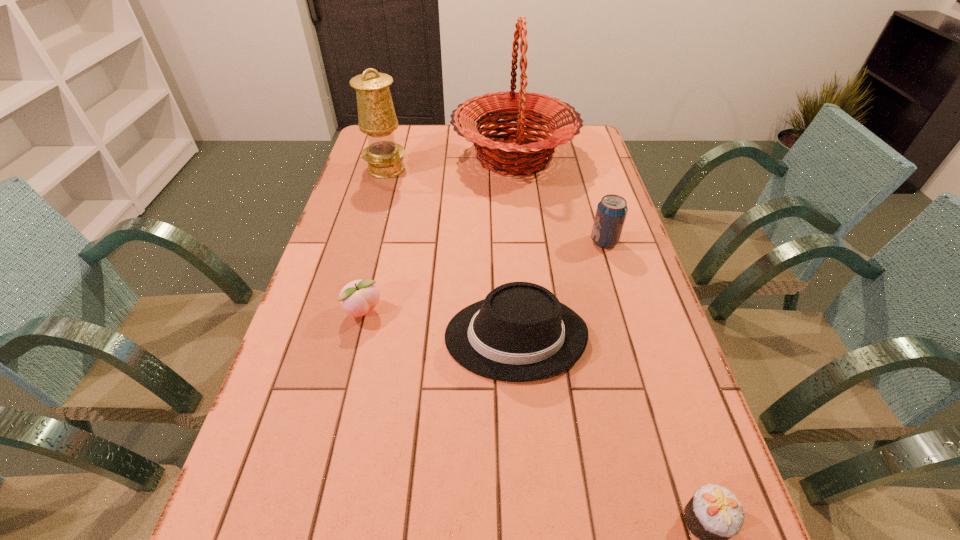
At what (x,y) coordinates should I click in order to perform the action: click on vacant area located on the front-facing side of the third shortest object. Please return your answer as a coordinate pair (x, y). This screenshot has height=540, width=960. Looking at the image, I should click on (376, 336).

Where is `vacant space situated on the front of the second shortest object`? Image resolution: width=960 pixels, height=540 pixels. vacant space situated on the front of the second shortest object is located at coordinates click(x=335, y=431).

This screenshot has width=960, height=540. In order to click on object present at the far edge in this screenshot , I will do `click(509, 156)`.

Identify the location of oil lamp that is at the left edge. (377, 118).

Where is `peach situated at the left edge`? The image size is (960, 540). peach situated at the left edge is located at coordinates (357, 298).

You are a GUI agent. You are given a task and a screenshot of the screen. Output one action in this format:
    pyautogui.click(x=<x>, y=<y>)
    Task: Click on the basket that is at the right edge
    This screenshot has width=960, height=540.
    Given the screenshot: What is the action you would take?
    pyautogui.click(x=509, y=156)

Find the location of a particular element. pop soda present at the right edge is located at coordinates (611, 212).

Where is `object that is at the far right corner`? object that is at the far right corner is located at coordinates (509, 156).

Find the location of `free space at the far edge of the desktop`. free space at the far edge of the desktop is located at coordinates (433, 148).

Find the location of a particular element. blank space at the left edge is located at coordinates (396, 179).